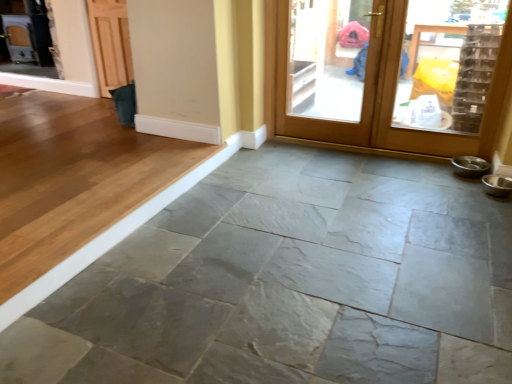
Question: Should I look upward or downward to see gray stone floor at center?

Choices:
 (A) up
 (B) down

Answer: (B)

Question: Is gray stone floor at center positioned with its back to wooden screen door at upper right?

Choices:
 (A) yes
 (B) no

Answer: (B)

Question: Is gray stone floor at center smaller than wooden screen door at upper right?

Choices:
 (A) no
 (B) yes

Answer: (A)

Question: Considering the relative positions of gray stone floor at center and wooden screen door at upper right in the image provided, is gray stone floor at center in front of wooden screen door at upper right?

Choices:
 (A) no
 (B) yes

Answer: (B)

Question: Is gray stone floor at center behind wooden screen door at upper right?

Choices:
 (A) no
 (B) yes

Answer: (A)

Question: From a real-world perspective, is gray stone floor at center on top of wooden screen door at upper right?

Choices:
 (A) yes
 (B) no

Answer: (B)

Question: Is gray stone floor at center outside wooden screen door at upper right?

Choices:
 (A) no
 (B) yes

Answer: (B)

Question: Is gray stone floor at center further to the viewer compared to wooden door at upper right?

Choices:
 (A) no
 (B) yes

Answer: (A)

Question: From a real-world perspective, is gray stone floor at center beneath wooden door at upper right?

Choices:
 (A) yes
 (B) no

Answer: (A)

Question: Can you see gray stone floor at center touching wooden door at upper right?

Choices:
 (A) yes
 (B) no

Answer: (B)

Question: Are gray stone floor at center and wooden door at upper right far apart?

Choices:
 (A) yes
 (B) no

Answer: (A)

Question: Does gray stone floor at center have a smaller size compared to wooden door at upper right?

Choices:
 (A) no
 (B) yes

Answer: (A)

Question: Can you confirm if gray stone floor at center is thinner than wooden door at upper right?

Choices:
 (A) no
 (B) yes

Answer: (A)

Question: Can you confirm if wooden door at upper right is taller than gray stone floor at center?

Choices:
 (A) no
 (B) yes

Answer: (B)